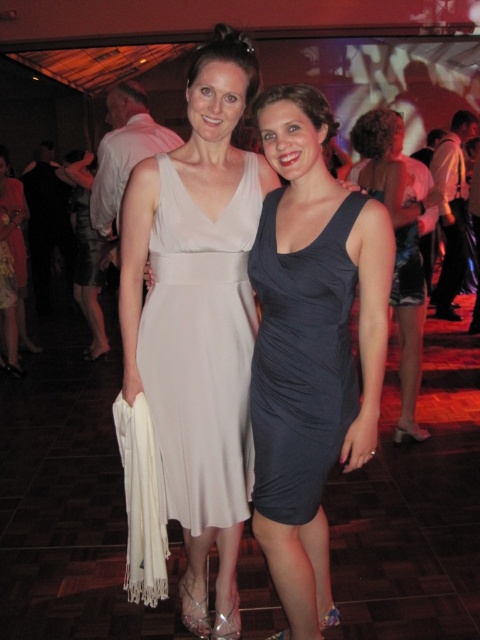
Question: Among these objects, which one is farthest from the camera?

Choices:
 (A) dark gray satin dress at center
 (B) dark blue satin dress at center

Answer: (B)

Question: Estimate the real-world distances between objects in this image. Which object is closer to the matte white dress at center?

Choices:
 (A) dark blue satin dress at center
 (B) satin white dress at center
 (C) dark gray satin dress at center

Answer: (B)

Question: Does matte white dress at center appear on the right side of dark blue satin dress at center?

Choices:
 (A) no
 (B) yes

Answer: (A)

Question: Does satin white dress at center have a smaller size compared to dark gray satin dress at center?

Choices:
 (A) no
 (B) yes

Answer: (A)

Question: Can you confirm if matte white dress at center is bigger than dark gray satin dress at center?

Choices:
 (A) no
 (B) yes

Answer: (B)

Question: Considering the real-world distances, which object is closest to the dark blue satin dress at center?

Choices:
 (A) satin white dress at center
 (B) dark gray satin dress at center
 (C) matte white dress at center

Answer: (C)